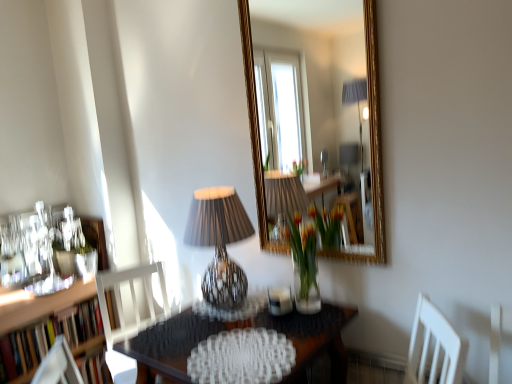
This screenshot has height=384, width=512. Identify the location of vacant region in front of translucent glass vase at center. pyautogui.click(x=311, y=314).